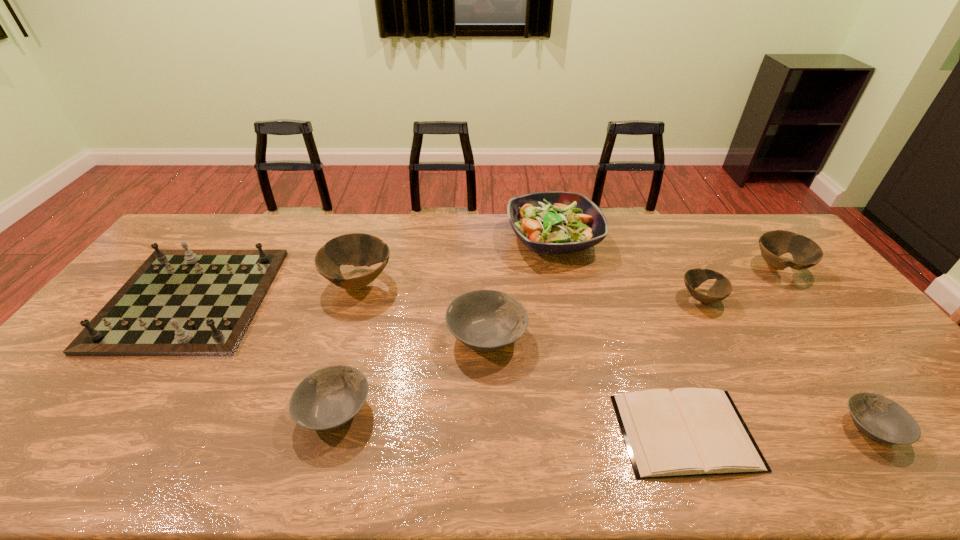
This screenshot has width=960, height=540. I want to click on vacant area at the far edge, so click(616, 237).

In order to click on vacant position at the near edge of the desktop in this screenshot , I will do `click(159, 477)`.

The image size is (960, 540). I want to click on free space at the far left corner of the desktop, so click(x=210, y=222).

The height and width of the screenshot is (540, 960). I want to click on free space at the far right corner of the desktop, so click(761, 224).

Where is `blank region between the blue salad plate and the tallest bowl`? The width and height of the screenshot is (960, 540). blank region between the blue salad plate and the tallest bowl is located at coordinates (456, 261).

The image size is (960, 540). I want to click on empty location between the biggest gray bowl and the second brown bowl from right to left, so click(593, 317).

What are the coordinates of `vacant area that lies between the smallest brown bowl and the shortest object` in the screenshot? It's located at (693, 365).

Where is `free spot between the eighth tallest object and the leftmost object`? free spot between the eighth tallest object and the leftmost object is located at coordinates (531, 363).

Find the location of a particular element. The height and width of the screenshot is (540, 960). empty location between the shortest object and the black chessboard is located at coordinates (438, 366).

The height and width of the screenshot is (540, 960). I want to click on empty space that is in between the shortest bowl and the shortest object, so click(779, 430).